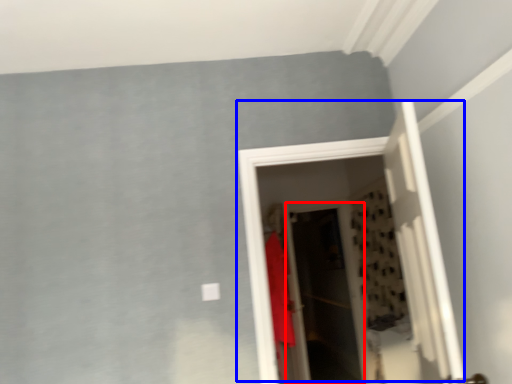
Question: Which object appears farthest to the camera in this image, screen door (highlighted by a red box) or door (highlighted by a blue box)?

Choices:
 (A) screen door
 (B) door

Answer: (A)